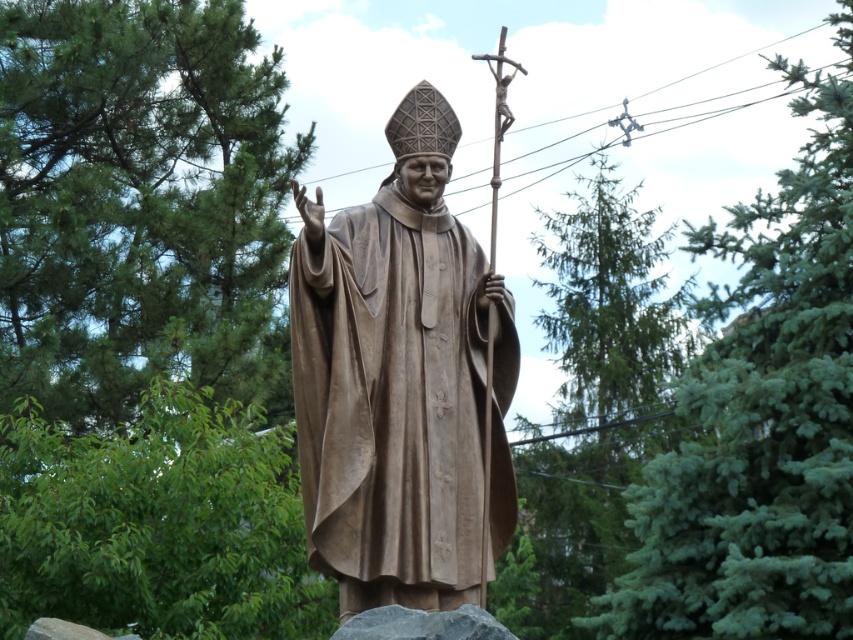
Which of these two, green leafy tree at upper left or green needle-like foliage at upper center, stands taller?

With more height is green needle-like foliage at upper center.

Is green leafy tree at upper left in front of green needle-like foliage at upper center?

No, it is not.

Describe the element at coordinates (140, 204) in the screenshot. I see `green leafy tree at upper left` at that location.

Image resolution: width=853 pixels, height=640 pixels. What are the coordinates of `green leafy tree at upper left` in the screenshot? It's located at (140, 204).

Between green leafy tree at upper left and bronze statue at center, which one has more height?

With more height is green leafy tree at upper left.

At what (x,y) coordinates should I click in order to perform the action: click on green leafy tree at upper left. Please return your answer as a coordinate pair (x, y). This screenshot has height=640, width=853. Looking at the image, I should click on (140, 204).

Between bronze statue at center and green coniferous tree at upper right, which one is positioned lower?

green coniferous tree at upper right

What do you see at coordinates (399, 381) in the screenshot? The image size is (853, 640). I see `bronze statue at center` at bounding box center [399, 381].

I want to click on bronze statue at center, so click(399, 381).

The height and width of the screenshot is (640, 853). Identify the location of bronze statue at center. (399, 381).